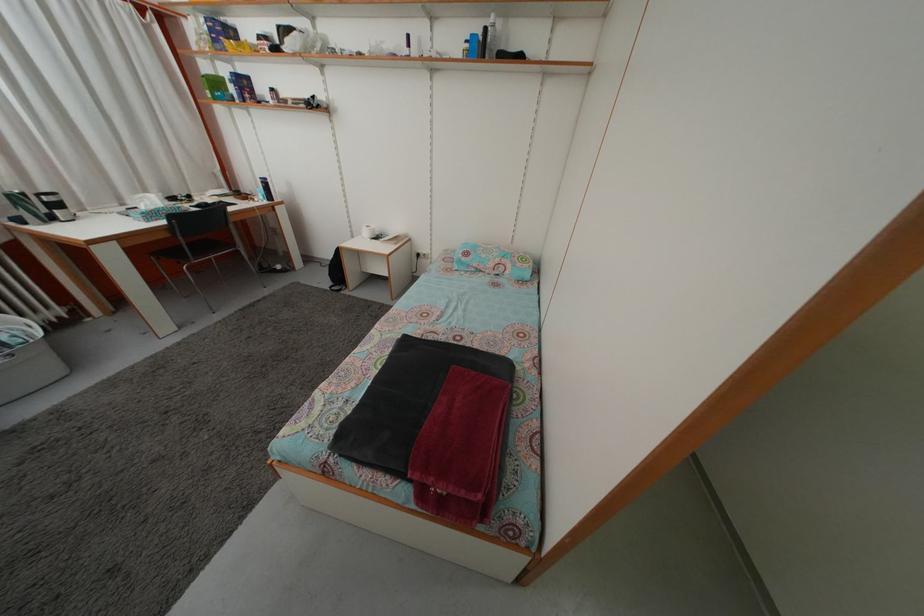
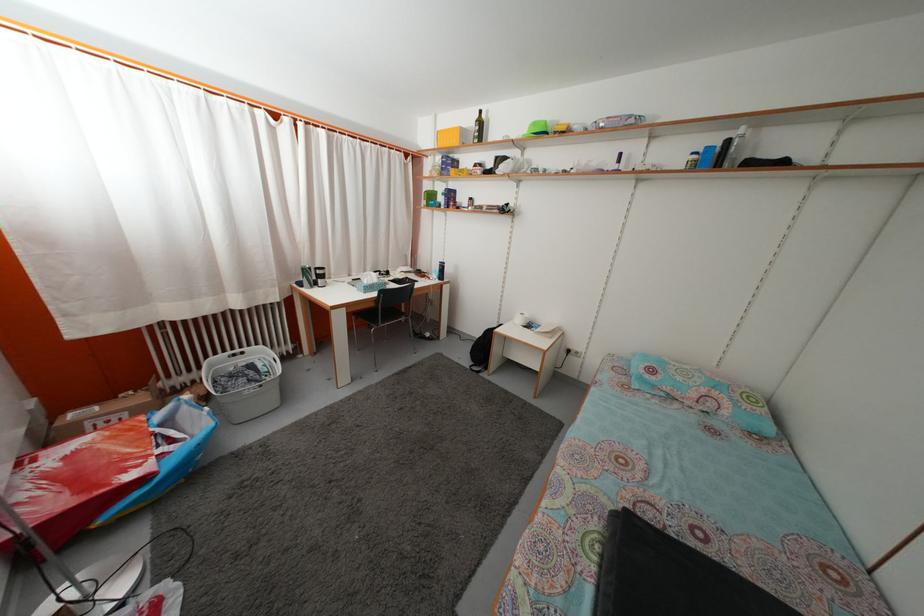
Question: The first image is from the beginning of the video and the second image is from the end. How did the camera likely rotate when shooting the video?

Choices:
 (A) Left
 (B) Right
 (C) Up
 (D) Down

Answer: (A)